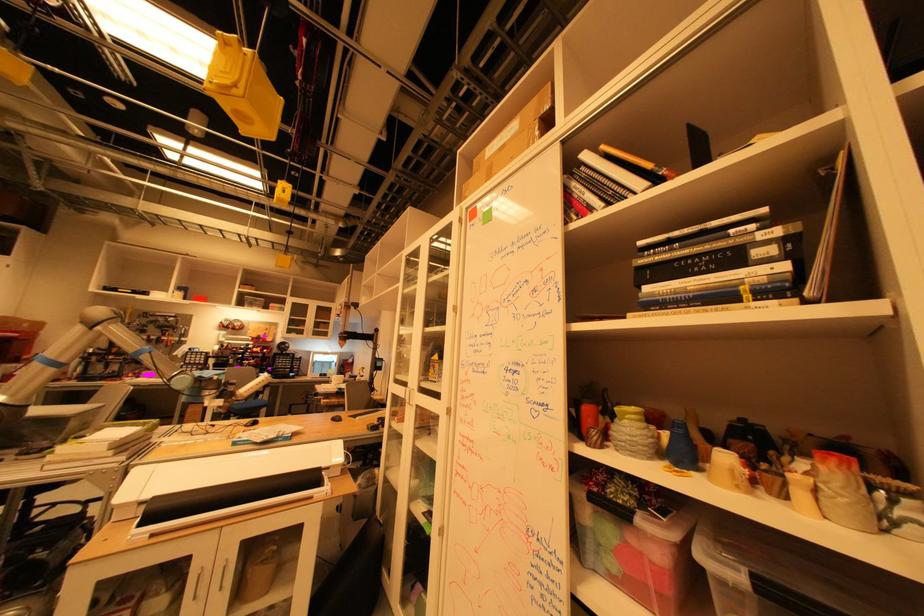
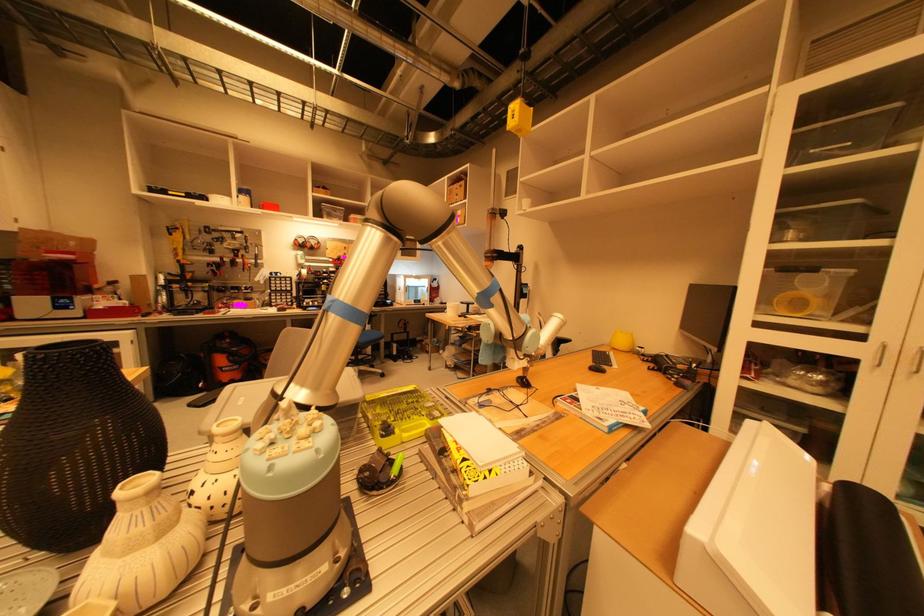
In a continuous first-person perspective shot, in which direction is the camera moving?

The movement direction of the cameraman is left, forward.